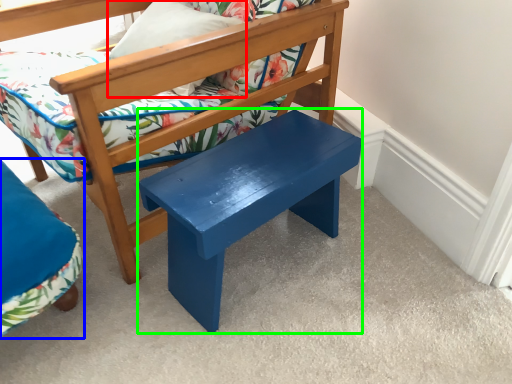
Question: Which is farther away from pillow (highlighted by a red box)? chair (highlighted by a blue box) or stool (highlighted by a green box)?

Choices:
 (A) chair
 (B) stool

Answer: (A)